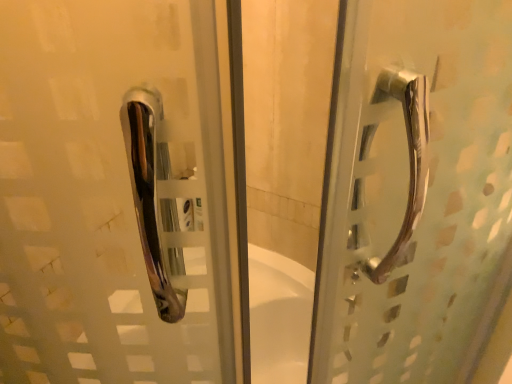
Question: Should I look upward or downward to see polished metal handle at right?

Choices:
 (A) down
 (B) up

Answer: (B)